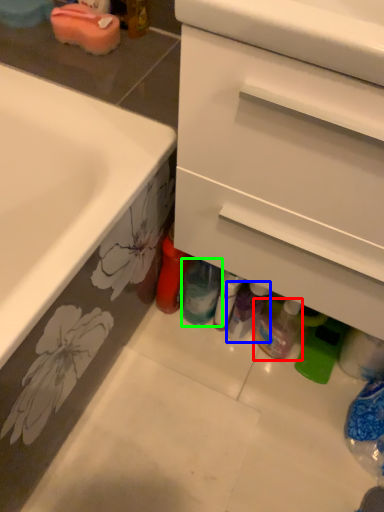
Question: Based on their relative distances, which object is farther from bottle (highlighted by a red box)? Choose from toiletry (highlighted by a blue box) and bottle (highlighted by a green box).

Choices:
 (A) toiletry
 (B) bottle

Answer: (B)